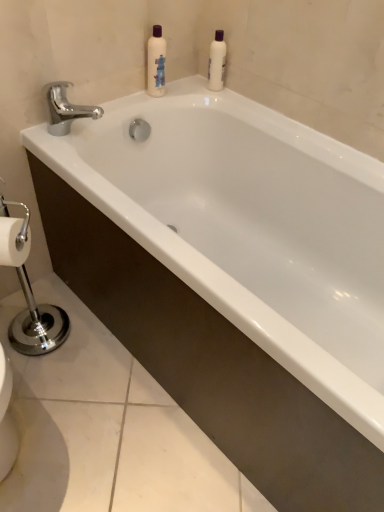
The height and width of the screenshot is (512, 384). I want to click on empty space that is in between white glossy bottle at upper center, marked as the second cleaning product in a right-to-left arrangement, and white plastic bottle at upper center, the 1th cleaning product positioned from the right, so click(x=193, y=89).